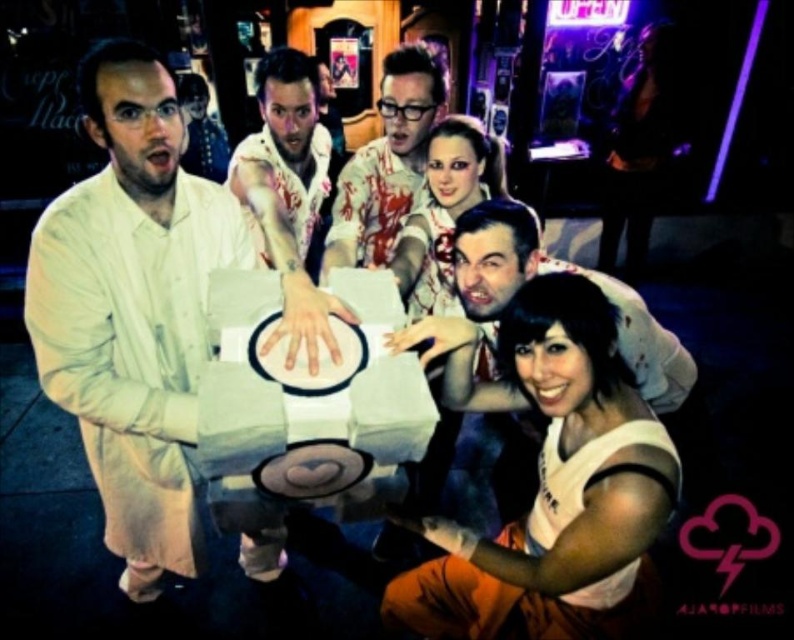
Question: Where is light beige lab coat at left located in relation to blood-stained white shirt at center in the image?

Choices:
 (A) below
 (B) above

Answer: (A)

Question: Estimate the real-world distances between objects in this image. Which object is farther from the matte white shirt at lower right?

Choices:
 (A) blood-stained shirt at center
 (B) light beige lab coat at left

Answer: (A)

Question: Estimate the real-world distances between objects in this image. Which object is closer to the blood-stained shirt at center?

Choices:
 (A) matte white shirt at lower right
 (B) light beige lab coat at left

Answer: (B)

Question: In this image, where is light beige lab coat at left located relative to matte white shirt at lower right?

Choices:
 (A) right
 (B) left

Answer: (B)

Question: Which object appears farthest from the camera in this image?

Choices:
 (A) blood-stained shirt at center
 (B) matte white shirt at lower right
 (C) blood-stained white shirt at center

Answer: (A)

Question: Does blood-stained shirt at center come behind blood-stained white shirt at center?

Choices:
 (A) yes
 (B) no

Answer: (A)